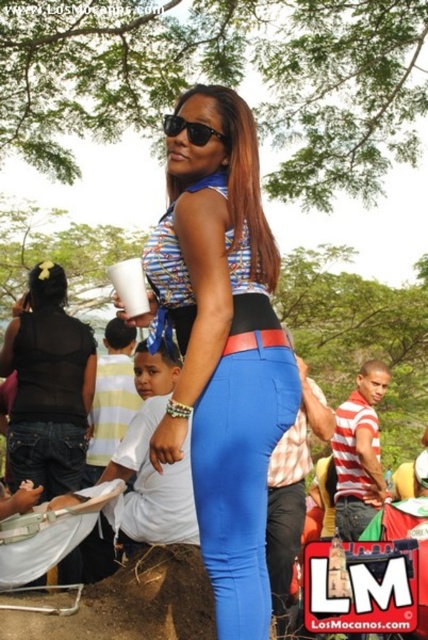
Is blue matte pants at center above black sheer top at upper left?

Indeed, blue matte pants at center is positioned over black sheer top at upper left.

Can you confirm if blue matte pants at center is positioned to the left of black sheer top at upper left?

In fact, blue matte pants at center is to the right of black sheer top at upper left.

Between point (249, 216) and point (17, 468), which one is positioned behind?

Point (17, 468)

This screenshot has width=428, height=640. I want to click on blue matte pants at center, so [222, 348].

Is blue matte pants at center smaller than brown dirt mound at lower left?

Incorrect, blue matte pants at center is not smaller in size than brown dirt mound at lower left.

Is point (174, 198) positioned in front of point (47, 593)?

That is True.

Who is more forward, (237, 541) or (137, 605)?

Positioned in front is point (237, 541).

At what (x,y) coordinates should I click in order to perform the action: click on blue matte pants at center. Please return your answer as a coordinate pair (x, y). Looking at the image, I should click on (222, 348).

Is blue smooth leggings at center closer to camera compared to black plastic sunglasses at upper center?

Yes, it is.

Is blue smooth leggings at center thinner than black plastic sunglasses at upper center?

Incorrect, blue smooth leggings at center's width is not less than black plastic sunglasses at upper center's.

Who is more distant from viewer, (261, 380) or (199, 145)?

The point (199, 145) is more distant.

Image resolution: width=428 pixels, height=640 pixels. Identify the location of blue smooth leggings at center. (240, 480).